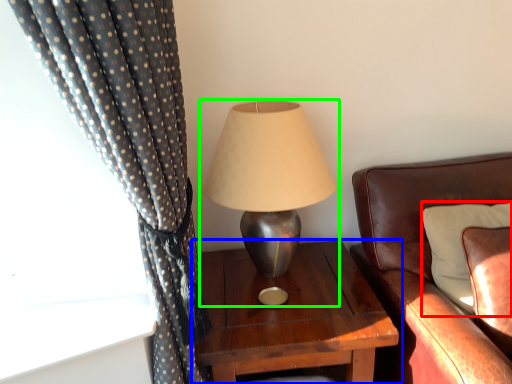
Question: Which object is the closest to the pillow (highlighted by a red box)? Choose among these: nightstand (highlighted by a blue box) or lamp (highlighted by a green box).

Choices:
 (A) nightstand
 (B) lamp

Answer: (A)